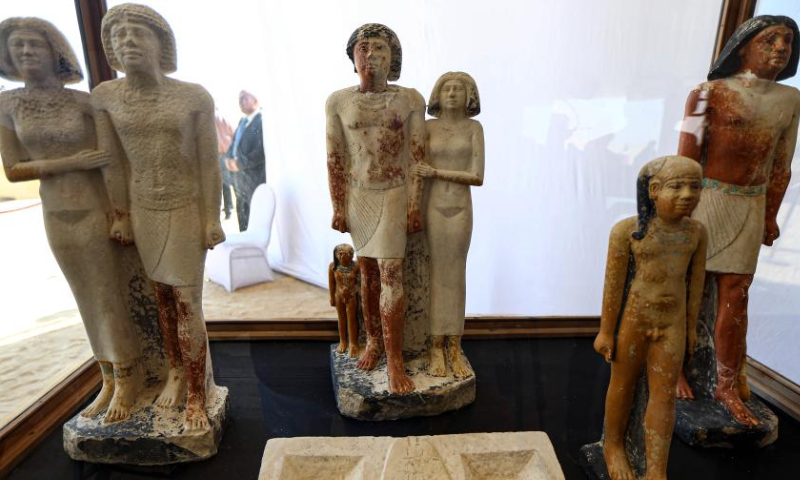
Where is `child statue on right side of display`? child statue on right side of display is located at coordinates (658, 335).